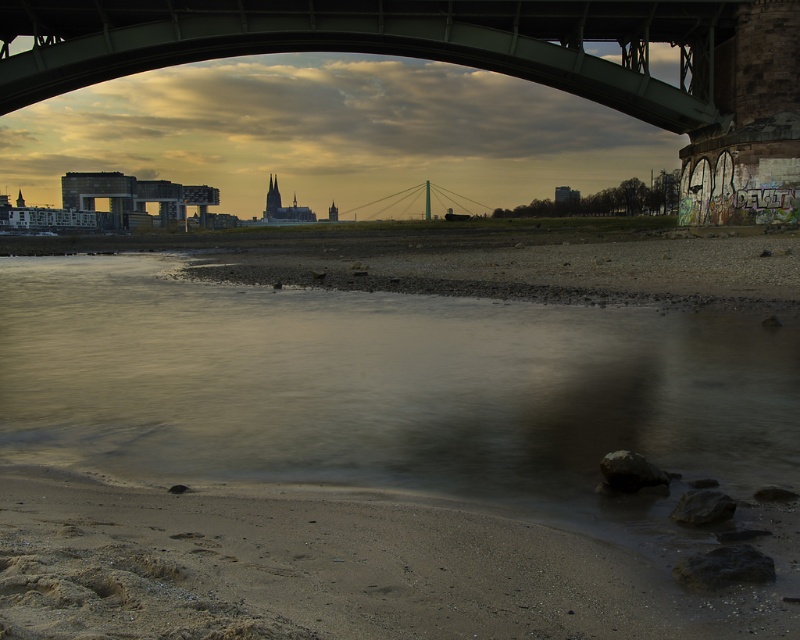
You are a photographer planning to capture the entire view of the green metallic bridge at upper center and the brown sand at lower center in one shot. Given that your camera can only focus on objects with a width of up to 2 meters, will both objects fit within the frame?

The brown sand at lower center has a lesser width compared to green metallic bridge at upper center. Since the camera can focus on objects up to 2 meters wide, the brown sand at lower center may fit, but the green metallic bridge at upper center might exceed the width limit. However, without knowing the exact width of the bridge, it is uncertain if both will fit.

You are standing on the brown sand at lower center and want to cross to the green metallic bridge at upper center. Is the bridge visible from your current position?

Yes, the green metallic bridge at upper center is visible from the brown sand at lower center because the brown sand at lower center is in front of the bridge, meaning there is a clear line of sight between them.